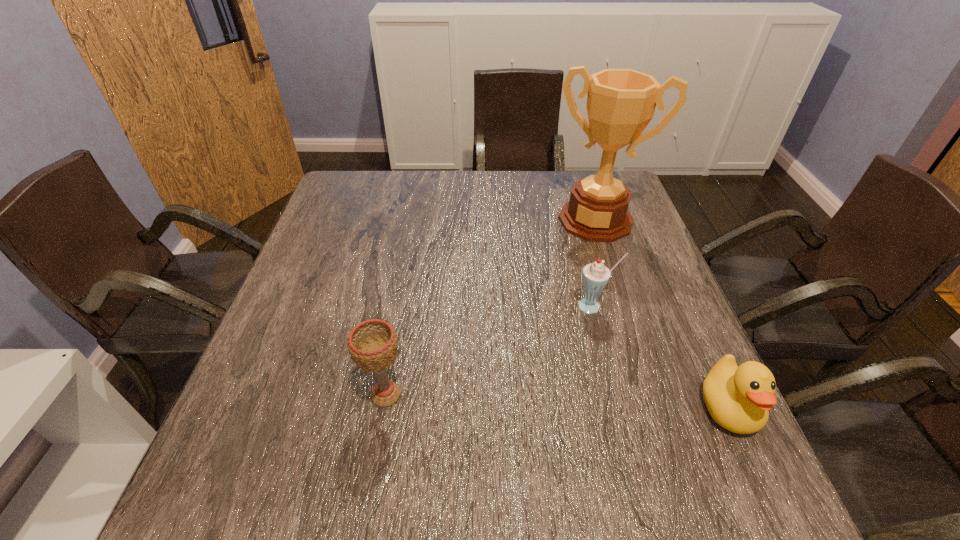
Locate an element on the screen. Image resolution: width=960 pixels, height=540 pixels. empty space between the award and the leftmost object is located at coordinates (491, 307).

You are a GUI agent. You are given a task and a screenshot of the screen. Output one action in this format:
    pyautogui.click(x=<x>, y=<y>)
    Task: Click on the vacant area between the leftmost object and the tallest object
    Image resolution: width=960 pixels, height=540 pixels.
    Given the screenshot: What is the action you would take?
    pyautogui.click(x=491, y=307)

Where is `object that is the third closest to the second farthest object`? This screenshot has width=960, height=540. object that is the third closest to the second farthest object is located at coordinates (372, 344).

Identify the location of the third closest object to the award. (372, 344).

Where is `vacant space that satisfies the following two spatial constraints: 1. on the back side of the leftmost object; 2. on the right side of the third nearest object`? The height and width of the screenshot is (540, 960). vacant space that satisfies the following two spatial constraints: 1. on the back side of the leftmost object; 2. on the right side of the third nearest object is located at coordinates (401, 306).

You are a GUI agent. You are given a task and a screenshot of the screen. Output one action in this format:
    pyautogui.click(x=<x>, y=<y>)
    Task: Click on the blank area in the image that satisfies the following two spatial constraints: 1. on the back side of the chalice; 2. on the left side of the award
    
    Given the screenshot: What is the action you would take?
    pyautogui.click(x=417, y=220)

At what (x,y) coordinates should I click in order to perform the action: click on vacant region that satisfies the following two spatial constraints: 1. on the back side of the award; 2. on the right side of the leftmost object. Please return your answer as a coordinate pair (x, y). Looking at the image, I should click on (417, 220).